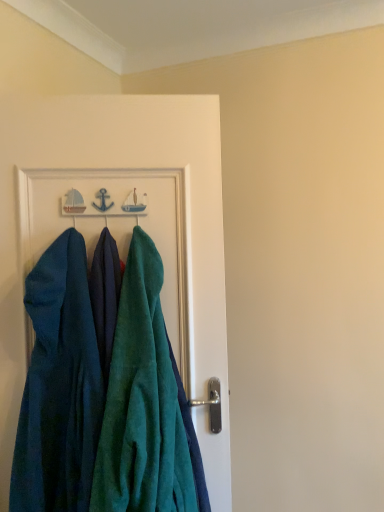
Question: Is teal velvety towel at center in front of or behind teal velvety dress at left in the image?

Choices:
 (A) behind
 (B) front

Answer: (B)

Question: Would you say teal velvety towel at center is inside or outside teal velvety dress at left?

Choices:
 (A) outside
 (B) inside

Answer: (A)

Question: Which object is the closest to the teal velvety dress at left?

Choices:
 (A) teal velvety towel at center
 (B) teal towel at center

Answer: (A)

Question: Based on their relative distances, which object is farther from the teal velvety towel at center?

Choices:
 (A) teal towel at center
 (B) teal velvety dress at left

Answer: (A)